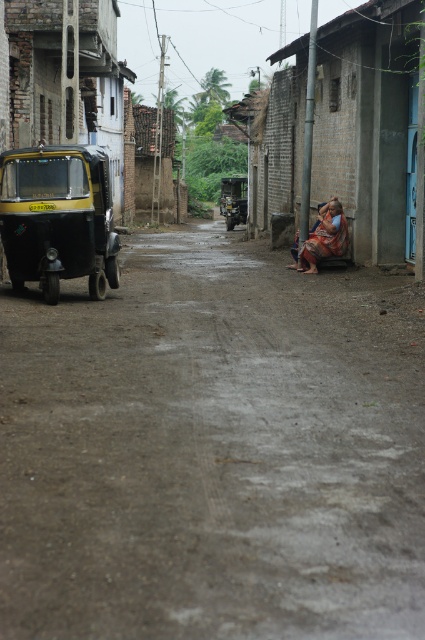
You are standing at the camera position and want to reach point (277, 328). Is the distance more than 10 meters?

The distance of point (277, 328) from camera is 9.83 meters, so the distance is less than 10 meters.

You are standing at the point with coordinates (373, 128) in the image. What object is located at this point?

The orange fabric bench at right is located at point (373, 128).